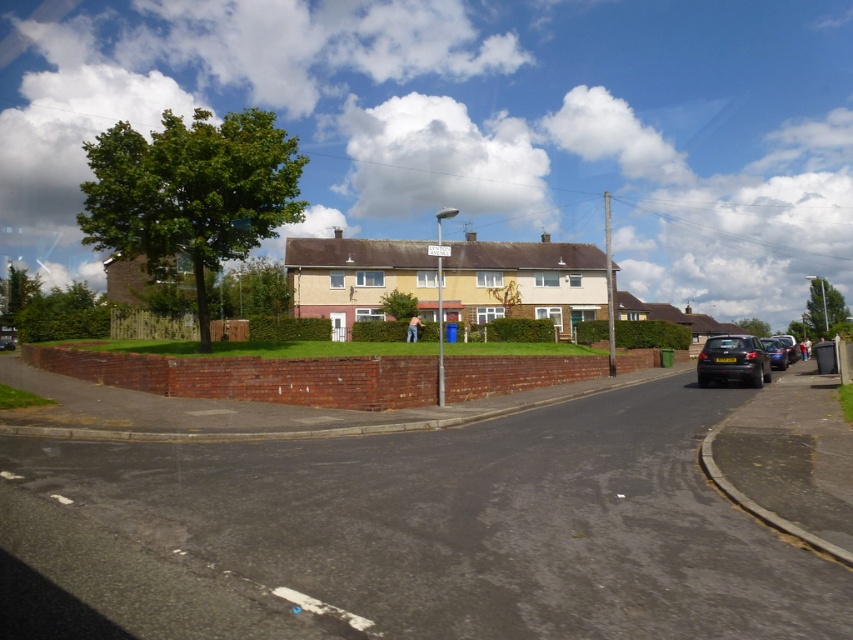
Question: Can you confirm if shiny black car at lower right is wider than shiny metallic car at right?

Choices:
 (A) no
 (B) yes

Answer: (A)

Question: Does shiny black car at lower right have a lesser width compared to shiny metallic car at right?

Choices:
 (A) no
 (B) yes

Answer: (B)

Question: From the image, what is the correct spatial relationship of shiny black car at lower right in relation to shiny metallic car at right?

Choices:
 (A) above
 (B) below

Answer: (B)

Question: Which point is closer to the camera?

Choices:
 (A) pyautogui.click(x=778, y=349)
 (B) pyautogui.click(x=709, y=369)

Answer: (B)

Question: Which point is farther to the camera?

Choices:
 (A) (761, 340)
 (B) (752, 374)

Answer: (A)